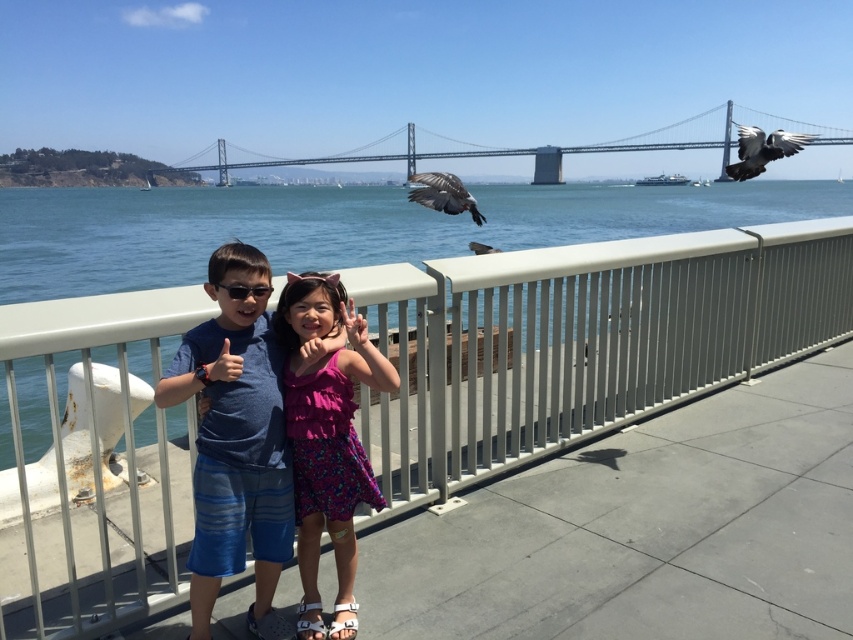
Is white metal railing at center shorter than gray feathered bird at upper right?

Indeed, white metal railing at center has a lesser height compared to gray feathered bird at upper right.

Which of these two, white metal railing at center or gray feathered bird at upper right, stands shorter?

Standing shorter between the two is white metal railing at center.

Where is `white metal railing at center`? The image size is (853, 640). white metal railing at center is located at coordinates (582, 340).

I want to click on white metal railing at center, so click(x=582, y=340).

Between blue striped shorts at center and black plastic sunglasses at center, which one appears on the right side from the viewer's perspective?

From the viewer's perspective, black plastic sunglasses at center appears more on the right side.

This screenshot has width=853, height=640. What do you see at coordinates (235, 442) in the screenshot?
I see `blue striped shorts at center` at bounding box center [235, 442].

The image size is (853, 640). What are the coordinates of `blue striped shorts at center` in the screenshot? It's located at (235, 442).

Between pink floral dress at center and gray feathered bird at upper right, which one is positioned lower?

pink floral dress at center is below.

Does point (308, 428) come behind point (738, 131)?

That is False.

The height and width of the screenshot is (640, 853). I want to click on pink floral dress at center, so click(x=328, y=440).